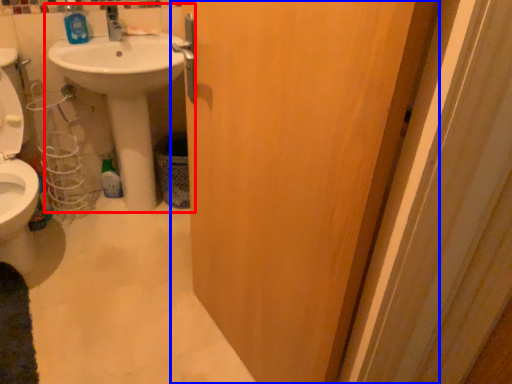
Question: Which point is further to the camera, sink (highlighted by a red box) or door (highlighted by a blue box)?

Choices:
 (A) sink
 (B) door

Answer: (A)